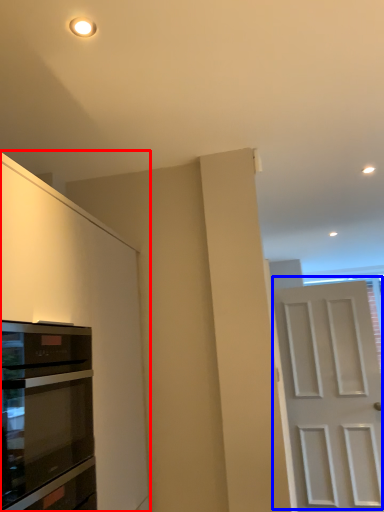
Question: Which point is further to the camera, cabinetry (highlighted by a red box) or door (highlighted by a blue box)?

Choices:
 (A) cabinetry
 (B) door

Answer: (B)